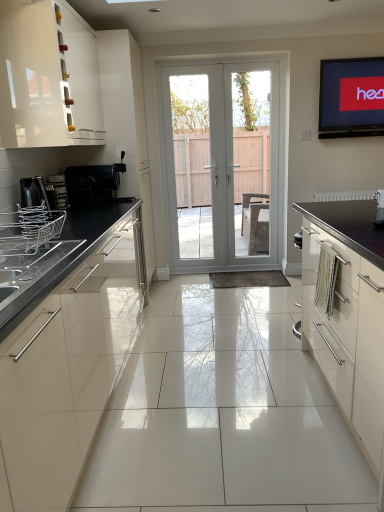
The image size is (384, 512). In order to click on white glossy door at center in this screenshot , I will do `click(221, 165)`.

The image size is (384, 512). What do you see at coordinates (221, 165) in the screenshot?
I see `white glossy door at center` at bounding box center [221, 165].

Find the location of a particular element. Image resolution: width=384 pixels, height=512 pixels. matte black tv at upper right is located at coordinates (351, 97).

The height and width of the screenshot is (512, 384). What do you see at coordinates (349, 317) in the screenshot?
I see `white glossy cabinet at right, which ranks as the 1th cabinetry in right-to-left order` at bounding box center [349, 317].

Describe the element at coordinates (252, 160) in the screenshot. I see `white glossy door at center, which is the 2th screen door in left-to-right order` at that location.

Find the location of a particular element. white glossy door at center is located at coordinates (221, 165).

Is point (63, 203) closer or farther from the camera than point (30, 219)?

Clearly, point (63, 203) is more distant from the camera than point (30, 219).

How different are the orientations of satin silver toaster at left, arranged as the 2th appliance when ordered from the bottom, and satin silver dish rack at left, positioned as the 1th appliance in front-to-back order, in degrees?

The facing directions of satin silver toaster at left, arranged as the 2th appliance when ordered from the bottom, and satin silver dish rack at left, positioned as the 1th appliance in front-to-back order, are 1.07 degrees apart.

Looking at this image, is satin silver toaster at left, the 2th appliance viewed from the top, in front of or behind satin silver dish rack at left, which is counted as the third appliance, starting from the top, in the image?

Clearly, satin silver toaster at left, the 2th appliance viewed from the top, is behind satin silver dish rack at left, which is counted as the third appliance, starting from the top.

From a real-world perspective, between satin silver toaster at left, the 2th appliance viewed from the top, and satin silver dish rack at left, arranged as the first appliance when ordered from the bottom, who is vertically lower?

satin silver dish rack at left, arranged as the first appliance when ordered from the bottom, is physically lower.

From the image's perspective, which object appears higher, satin silver dish rack at left, which is counted as the third appliance, starting from the top, or matte black tv at upper right?

From the image's view, matte black tv at upper right is above.

You are a GUI agent. You are given a task and a screenshot of the screen. Output one action in this format:
    pyautogui.click(x=<x>, y=<y>)
    Task: Click on the electronic on the right of satin silver dish rack at left, which is counted as the third appliance, starting from the top
    This screenshot has height=512, width=384.
    Given the screenshot: What is the action you would take?
    pyautogui.click(x=351, y=97)

Which object is closer to the camera taking this photo, satin silver dish rack at left, positioned as the 1th appliance in front-to-back order, or matte black tv at upper right?

satin silver dish rack at left, positioned as the 1th appliance in front-to-back order.

Considering the sizes of satin silver dish rack at left, marked as the third appliance in a back-to-front arrangement, and matte black tv at upper right in the image, is satin silver dish rack at left, marked as the third appliance in a back-to-front arrangement, bigger or smaller than matte black tv at upper right?

Considering their sizes, satin silver dish rack at left, marked as the third appliance in a back-to-front arrangement, takes up less space than matte black tv at upper right.

Can you confirm if white glossy cabinet at right, which is the 1th cabinetry from bottom to top, is thinner than black matte coffee machine at left, placed as the third appliance when sorted from front to back?

No.

Is black matte coffee machine at left, the 3th appliance from the bottom, surrounded by white glossy cabinet at right, the second cabinetry positioned from the left?

No, black matte coffee machine at left, the 3th appliance from the bottom, is not a part of white glossy cabinet at right, the second cabinetry positioned from the left.

Between point (371, 247) and point (98, 165), which one is positioned behind?

Point (371, 247)

From a real-world perspective, is white glossy cabinet at right, which is the 1th cabinetry from bottom to top, positioned over black matte coffee machine at left, placed as the third appliance when sorted from front to back, based on gravity?

No.

How different are the orientations of black matte coffee machine at left, arranged as the 1th appliance when viewed from the back, and satin silver dish rack at left, marked as the third appliance in a back-to-front arrangement, in degrees?

The angle between the facing direction of black matte coffee machine at left, arranged as the 1th appliance when viewed from the back, and the facing direction of satin silver dish rack at left, marked as the third appliance in a back-to-front arrangement, is 0.435 degrees.

In the scene shown: Is black matte coffee machine at left, arranged as the 1th appliance when viewed from the back, oriented towards satin silver dish rack at left, marked as the third appliance in a back-to-front arrangement?

No.

Which of these two, black matte coffee machine at left, the 3th appliance from the bottom, or satin silver dish rack at left, marked as the third appliance in a back-to-front arrangement, is bigger?

black matte coffee machine at left, the 3th appliance from the bottom.

Between black matte coffee machine at left, placed as the third appliance when sorted from front to back, and satin silver dish rack at left, positioned as the 1th appliance in front-to-back order, which one is positioned in front?

satin silver dish rack at left, positioned as the 1th appliance in front-to-back order.

Is point (231, 267) closer to camera compared to point (56, 192)?

No, (231, 267) is behind (56, 192).

Between white glossy door at center and satin silver toaster at left, the second appliance from the front, which one is positioned in front?

satin silver toaster at left, the second appliance from the front, is more forward.

Considering the sizes of objects white glossy door at center and satin silver toaster at left, the 2th appliance viewed from the top, in the image provided, who is shorter, white glossy door at center or satin silver toaster at left, the 2th appliance viewed from the top,?

satin silver toaster at left, the 2th appliance viewed from the top.

From the image's perspective, is white glossy door at center positioned above or below satin silver toaster at left, arranged as the 2th appliance when ordered from the bottom?

From the image's perspective, white glossy door at center appears above satin silver toaster at left, arranged as the 2th appliance when ordered from the bottom.

Is white glossy door at center, which is the 2th screen door in left-to-right order, to the left of white glossy cabinet at right, which ranks as the 1th cabinetry in right-to-left order, from the viewer's perspective?

Yes, white glossy door at center, which is the 2th screen door in left-to-right order, is to the left of white glossy cabinet at right, which ranks as the 1th cabinetry in right-to-left order.

Considering the relative sizes of white glossy door at center, which is counted as the first screen door, starting from the right, and white glossy cabinet at right, the second cabinetry positioned from the left, in the image provided, is white glossy door at center, which is counted as the first screen door, starting from the right, taller than white glossy cabinet at right, the second cabinetry positioned from the left,?

Yes, white glossy door at center, which is counted as the first screen door, starting from the right, is taller than white glossy cabinet at right, the second cabinetry positioned from the left.

Which is closer to the camera, (238,141) or (372,270)?

The point (372,270) is in front.

Is white glossy cabinet at upper left, which is the first cabinetry in top-to-bottom order, oriented away from clear glass door at center, positioned as the 1th screen door in left-to-right order?

No, white glossy cabinet at upper left, which is the first cabinetry in top-to-bottom order, is not facing the opposite direction of clear glass door at center, positioned as the 1th screen door in left-to-right order.

Who is taller, white glossy cabinet at upper left, which is the first cabinetry in top-to-bottom order, or clear glass door at center, positioned as the 1th screen door in left-to-right order?

clear glass door at center, positioned as the 1th screen door in left-to-right order, is taller.

Between white glossy cabinet at upper left, marked as the second cabinetry in a right-to-left arrangement, and clear glass door at center, which ranks as the 2th screen door in right-to-left order, which one has larger width?

Wider between the two is white glossy cabinet at upper left, marked as the second cabinetry in a right-to-left arrangement.

From the image's perspective, is white glossy cabinet at upper left, which is the 2th cabinetry in bottom-to-top order, above clear glass door at center, which ranks as the 2th screen door in right-to-left order?

Yes, from the image's perspective, white glossy cabinet at upper left, which is the 2th cabinetry in bottom-to-top order, is above clear glass door at center, which ranks as the 2th screen door in right-to-left order.

This screenshot has height=512, width=384. What are the coordinates of `appliance below the satin silver toaster at left, the 2th appliance viewed from the top (from the image's perspective)` in the screenshot? It's located at (29, 229).

There is a matte black tv at upper right. Identify the location of the 3rd appliance below it (from a real-world perspective). (29, 229).

Estimate the real-world distances between objects in this image. Which object is closer to white glossy cabinet at right, which is the 1th cabinetry from bottom to top, clear glass door at center, positioned as the 1th screen door in left-to-right order, or satin silver dish rack at left, arranged as the first appliance when ordered from the bottom?

The object closer to white glossy cabinet at right, which is the 1th cabinetry from bottom to top, is satin silver dish rack at left, arranged as the first appliance when ordered from the bottom.

Considering their positions, is white glossy door at center, which is the 2th screen door in left-to-right order, positioned closer to white glossy door at center than black matte coffee machine at left, the 3th appliance from the bottom?

white glossy door at center, which is the 2th screen door in left-to-right order, lies closer to white glossy door at center than the other object.

Estimate the real-world distances between objects in this image. Which object is closer to matte black tv at upper right, white glossy cabinet at upper left, which appears as the 1th cabinetry when viewed from the left, or black matte coffee machine at left, arranged as the 1th appliance when viewed from the back?

The object closer to matte black tv at upper right is black matte coffee machine at left, arranged as the 1th appliance when viewed from the back.

Based on their spatial positions, is satin silver dish rack at left, arranged as the first appliance when ordered from the bottom, or matte black tv at upper right further from clear glass door at center, which ranks as the 2th screen door in right-to-left order?

Among the two, satin silver dish rack at left, arranged as the first appliance when ordered from the bottom, is located further to clear glass door at center, which ranks as the 2th screen door in right-to-left order.

From the image, which object appears to be farther from satin silver dish rack at left, arranged as the first appliance when ordered from the bottom, white glossy cabinet at right, which is the 1th cabinetry from bottom to top, or black matte coffee machine at left, placed as the third appliance when sorted from front to back?

white glossy cabinet at right, which is the 1th cabinetry from bottom to top, is further to satin silver dish rack at left, arranged as the first appliance when ordered from the bottom.

Based on their spatial positions, is white glossy door at center, which is the 2th screen door in left-to-right order, or satin silver dish rack at left, marked as the third appliance in a back-to-front arrangement, further from black matte coffee machine at left, arranged as the 1th appliance when viewed from the back?

white glossy door at center, which is the 2th screen door in left-to-right order, is further to black matte coffee machine at left, arranged as the 1th appliance when viewed from the back.

Based on their spatial positions, is black matte coffee machine at left, arranged as the 1th appliance when viewed from the back, or white glossy door at center further from matte black tv at upper right?

black matte coffee machine at left, arranged as the 1th appliance when viewed from the back, lies further to matte black tv at upper right than the other object.

Based on their spatial positions, is matte black tv at upper right or satin silver dish rack at left, which is counted as the third appliance, starting from the top, closer to white glossy door at center?

Among the two, matte black tv at upper right is located nearer to white glossy door at center.

Where is `electronic located between satin silver dish rack at left, which is counted as the third appliance, starting from the top, and clear glass door at center, positioned as the 1th screen door in left-to-right order, in the depth direction`? The image size is (384, 512). electronic located between satin silver dish rack at left, which is counted as the third appliance, starting from the top, and clear glass door at center, positioned as the 1th screen door in left-to-right order, in the depth direction is located at coordinates (351, 97).

This screenshot has height=512, width=384. I want to click on cabinetry between white glossy cabinet at right, which ranks as the 1th cabinetry in right-to-left order, and white glossy door at center, which is the 2th screen door in left-to-right order, along the z-axis, so click(x=48, y=77).

The width and height of the screenshot is (384, 512). I want to click on door situated between black matte coffee machine at left, arranged as the 1th appliance when viewed from the back, and white glossy door at center, which is counted as the first screen door, starting from the right, from left to right, so click(221, 165).

You are a GUI agent. You are given a task and a screenshot of the screen. Output one action in this format:
    pyautogui.click(x=<x>, y=<y>)
    Task: Click on the electronic positioned between white glossy cabinet at right, which is counted as the 2th cabinetry, starting from the top, and white glossy door at center, which is counted as the first screen door, starting from the right, from near to far
    The width and height of the screenshot is (384, 512).
    Given the screenshot: What is the action you would take?
    pyautogui.click(x=351, y=97)